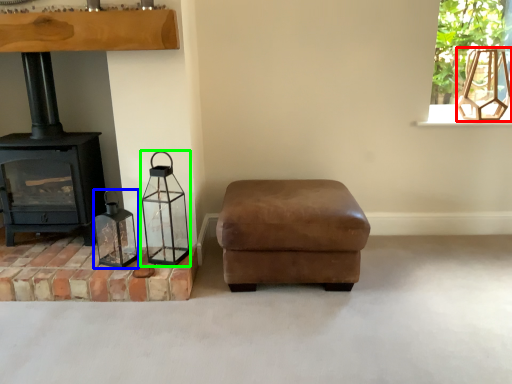
Question: Estimate the real-world distances between objects in this image. Which object is farther from lamp (highlighted by a red box), candle holder (highlighted by a blue box) or candle holder (highlighted by a green box)?

Choices:
 (A) candle holder
 (B) candle holder

Answer: (A)